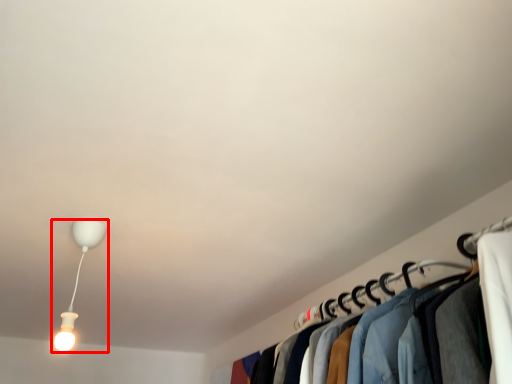
Question: From the image's perspective, what is the correct spatial positioning of lamp (annotated by the red box) in reference to closet?

Choices:
 (A) below
 (B) above

Answer: (B)